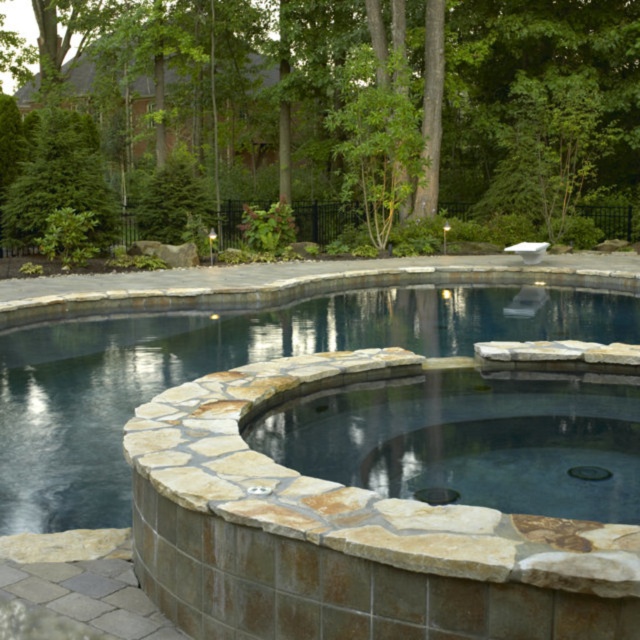
You are standing at the edge of the pool deck and want to reach the point marked at coordinates [237,362]. Is this point located on the natural stone pool at center?

Yes, the point marked at coordinates [237,362] is located on the natural stone pool at center according to the provided information.

You are planning to install a new bench in the backyard. The bench must be placed between the green leafy tree at upper center and the natural stone hot tub at center. Considering their sizes, which object should the bench be closer to?

The bench should be placed closer to the natural stone hot tub at center because the green leafy tree at upper center is bigger, so there might be less space around it for the bench.

You are planning to install a new lighting system around the natural stone pool at center. Considering the green leafy tree at upper center, which object has a greater width that might cast shadows over the pool area?

The green leafy tree at upper center has a greater width than the natural stone pool at center, so it might cast larger shadows over the pool area.